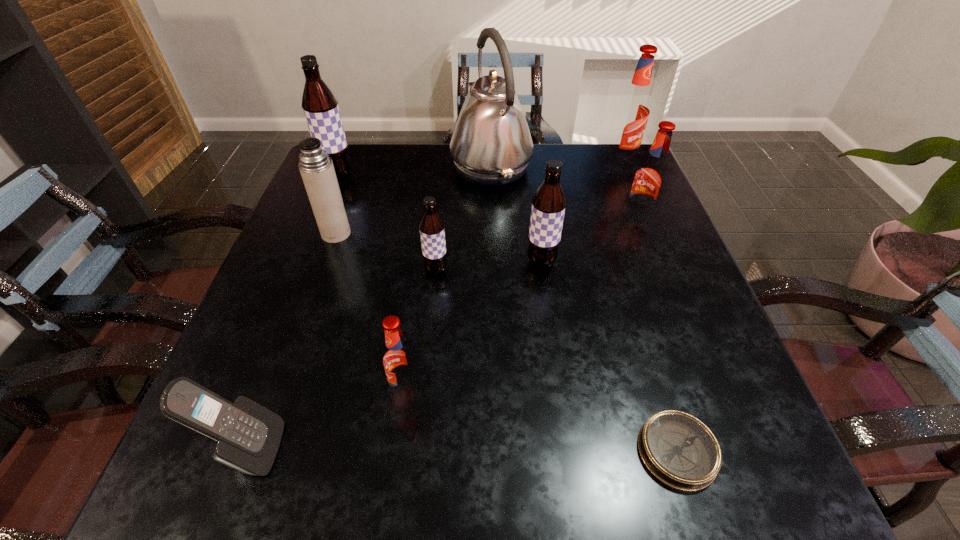
Where is `vacant space at the near left corner`? This screenshot has width=960, height=540. vacant space at the near left corner is located at coordinates (192, 448).

At what (x,y) coordinates should I click in order to perform the action: click on free space at the far right corner. Please return your answer as a coordinate pair (x, y). The width and height of the screenshot is (960, 540). Looking at the image, I should click on (597, 158).

At what (x,y) coordinates should I click in order to perform the action: click on vacant space that's between the kettle and the second nearest red root beer. Please return your answer as a coordinate pair (x, y). Looking at the image, I should click on (564, 193).

The width and height of the screenshot is (960, 540). What are the coordinates of `blank region between the second brown root beer from right to left and the kettle` in the screenshot? It's located at tap(464, 218).

Locate an element on the screen. This screenshot has height=540, width=960. free space between the biggest red root beer and the thermos bottle is located at coordinates (478, 197).

The image size is (960, 540). I want to click on free spot between the second brown root beer from right to left and the kettle, so click(x=464, y=218).

The image size is (960, 540). I want to click on vacant point located between the cellular telephone and the shortest object, so click(x=463, y=450).

The height and width of the screenshot is (540, 960). Find the location of `free space between the cellular telephone and the biggest red root beer`. free space between the cellular telephone and the biggest red root beer is located at coordinates (435, 305).

This screenshot has height=540, width=960. What are the coordinates of `empty space between the biggest brown root beer and the compass` in the screenshot? It's located at (508, 313).

Identify the location of object that is the eighth closest to the cellular telephone. Image resolution: width=960 pixels, height=540 pixels. (650, 178).